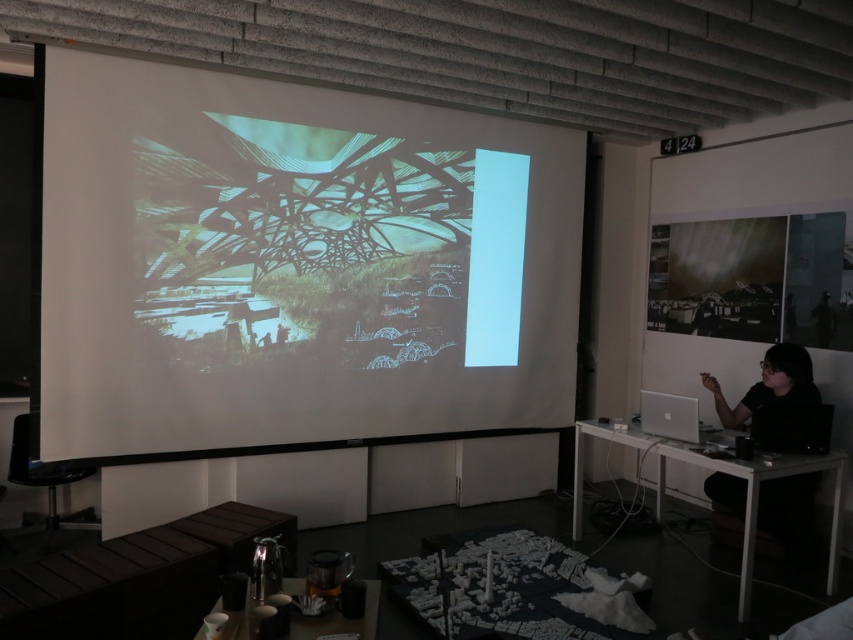
Consider the image. Who is more distant from viewer, (x=51, y=452) or (x=746, y=486)?

Positioned behind is point (x=746, y=486).

Is point (457, 342) positioned behind point (775, 362)?

Yes, point (457, 342) is farther from viewer.

This screenshot has height=640, width=853. I want to click on white matte projection screen at center, so click(x=294, y=266).